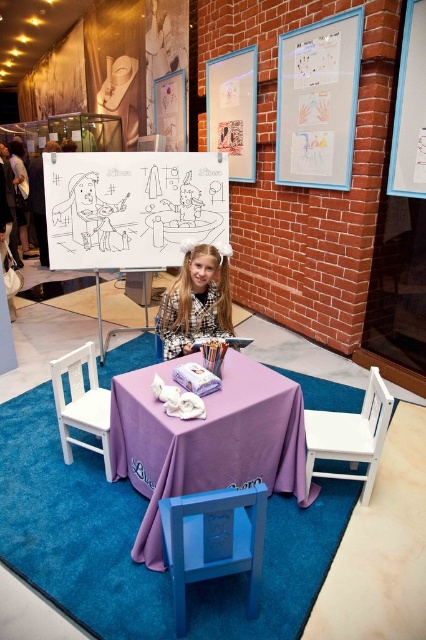
Which is above, blonde hair at center or white wood chair at lower left?

blonde hair at center is higher up.

Is point (222, 316) farther from camera compared to point (74, 413)?

Yes, it is behind point (74, 413).

Which is in front, point (175, 355) or point (77, 365)?

Point (77, 365) is in front.

This screenshot has width=426, height=640. Find the location of `blonde hair at center`. blonde hair at center is located at coordinates (195, 301).

Which is more to the right, purple fabric tablecloth at center or white wood chair at lower right?

Positioned to the right is white wood chair at lower right.

In the scene shown: Can you confirm if purple fabric tablecloth at center is thinner than white wood chair at lower right?

No, purple fabric tablecloth at center is not thinner than white wood chair at lower right.

The height and width of the screenshot is (640, 426). What do you see at coordinates (207, 440) in the screenshot? I see `purple fabric tablecloth at center` at bounding box center [207, 440].

What are the coordinates of `purple fabric tablecloth at center` in the screenshot? It's located at (207, 440).

Is purple fabric tablecloth at center taller than blonde hair at center?

Correct, purple fabric tablecloth at center is much taller as blonde hair at center.

Is purple fabric tablecloth at center closer to camera compared to blonde hair at center?

Yes.

Measure the distance between purple fabric tablecloth at center and camera.

purple fabric tablecloth at center is 6.34 feet from camera.

Identify the location of purple fabric tablecloth at center. (207, 440).